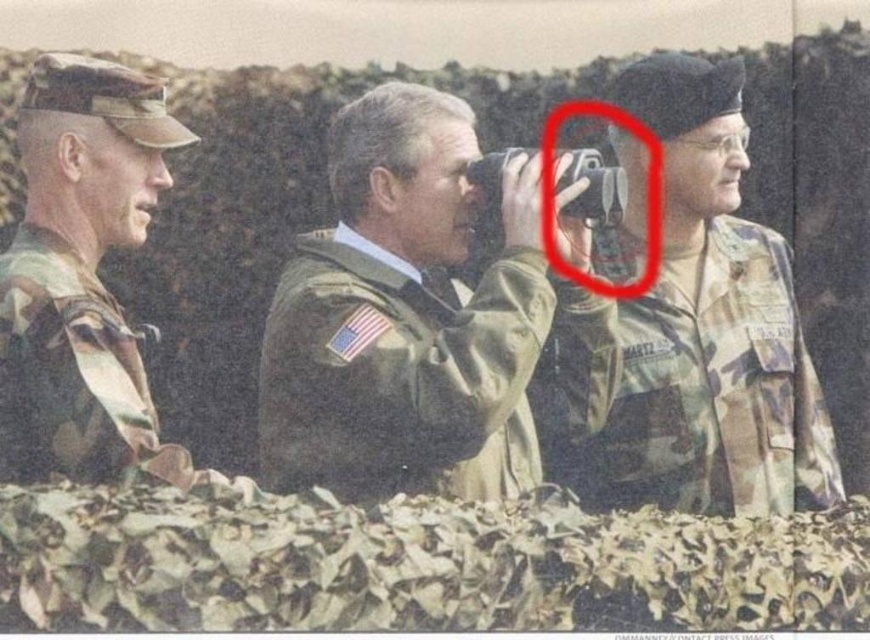
Question: Observing the image, what is the correct spatial positioning of camouflage jacket at center in reference to camo uniform at left?

Choices:
 (A) above
 (B) below

Answer: (B)

Question: Which object is positioned closest to the camo uniform at left?

Choices:
 (A) camo fabric uniform at center
 (B) camouflage jacket at center

Answer: (B)

Question: Estimate the real-world distances between objects in this image. Which object is closer to the camo uniform at left?

Choices:
 (A) camouflage jacket at center
 (B) camo fabric uniform at center

Answer: (A)

Question: Which point is closer to the camera?

Choices:
 (A) camo uniform at left
 (B) camouflage jacket at center

Answer: (A)

Question: Where is camouflage jacket at center located in relation to camo fabric uniform at center in the image?

Choices:
 (A) below
 (B) above

Answer: (B)

Question: Does camo fabric uniform at center appear on the left side of camo uniform at left?

Choices:
 (A) no
 (B) yes

Answer: (A)